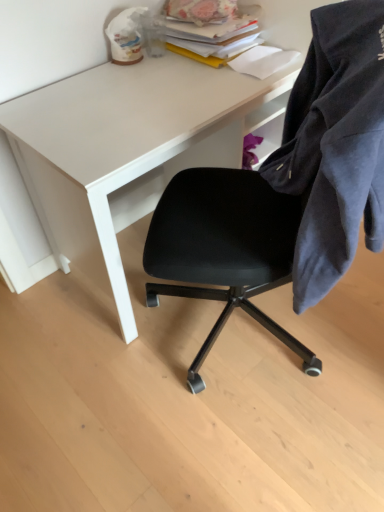
Question: Should I look upward or downward to see dark blue cotton jacket at right?

Choices:
 (A) up
 (B) down

Answer: (A)

Question: Is white matte desk at upper center oriented away from stacked paper at upper right?

Choices:
 (A) no
 (B) yes

Answer: (A)

Question: Is white matte desk at upper center far from stacked paper at upper right?

Choices:
 (A) yes
 (B) no

Answer: (B)

Question: From the image's perspective, is white matte desk at upper center below stacked paper at upper right?

Choices:
 (A) no
 (B) yes

Answer: (B)

Question: Is stacked paper at upper right a part of white matte desk at upper center?

Choices:
 (A) yes
 (B) no

Answer: (B)

Question: Does white matte desk at upper center have a greater width compared to stacked paper at upper right?

Choices:
 (A) yes
 (B) no

Answer: (A)

Question: Can you confirm if white matte desk at upper center is shorter than stacked paper at upper right?

Choices:
 (A) no
 (B) yes

Answer: (A)

Question: Is stacked paper at upper right positioned beyond the bounds of white matte desk at upper center?

Choices:
 (A) yes
 (B) no

Answer: (A)

Question: Is stacked paper at upper right directly adjacent to white matte desk at upper center?

Choices:
 (A) yes
 (B) no

Answer: (B)

Question: Is stacked paper at upper right looking in the opposite direction of white matte desk at upper center?

Choices:
 (A) yes
 (B) no

Answer: (B)

Question: Does stacked paper at upper right come in front of white matte desk at upper center?

Choices:
 (A) no
 (B) yes

Answer: (A)

Question: Could you tell me if stacked paper at upper right is turned towards white matte desk at upper center?

Choices:
 (A) yes
 (B) no

Answer: (B)

Question: Can you confirm if stacked paper at upper right is smaller than white matte desk at upper center?

Choices:
 (A) no
 (B) yes

Answer: (B)

Question: Would you say white matte desk at upper center is outside dark blue cotton jacket at right?

Choices:
 (A) yes
 (B) no

Answer: (A)